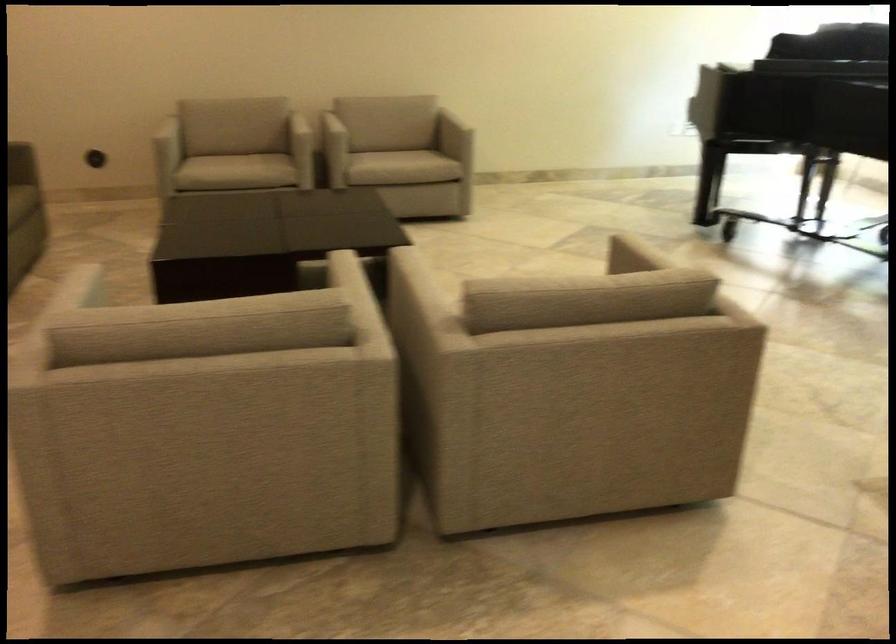
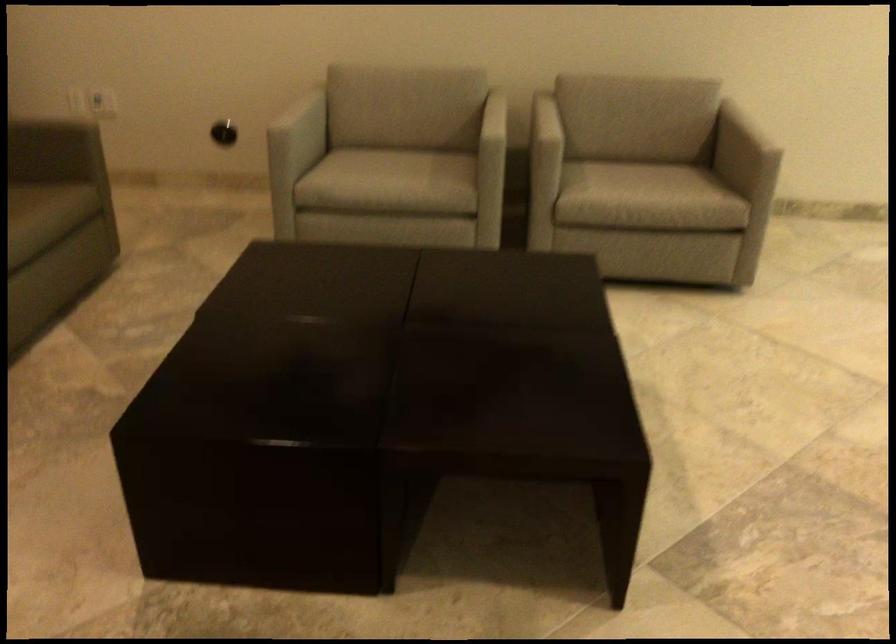
Locate, in the second image, the point that corresponds to the point at 238,163 in the first image.

(390, 176)